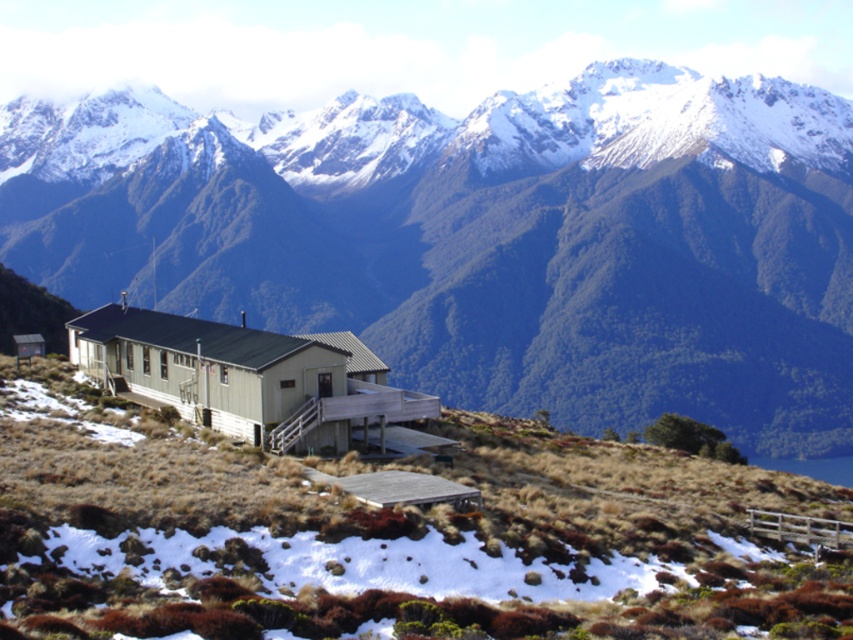
You are planning a hiking route and need to know the order of the landscape features from closest to farthest. Based on the image, which comes first, the snowy rock mountain range at upper center or the green wood hillside at center?

The snowy rock mountain range at upper center comes first because the green wood hillside at center is behind it, meaning the mountain range is closer to the viewer.

You are a hiker standing at the base of the slope where the small building is located. You want to reach the snowy rock mountain range at upper center. Based on the distance provided, can you estimate how long it would take to hike there if your average hiking speed is 2 miles per hour?

The distance between you and the snowy rock mountain range at upper center is 1309.66 feet. Converting that to miles, it is approximately 0.25 miles. At an average hiking speed of 2 miles per hour, it would take about 7.5 minutes to reach the snowy rock mountain range at upper center.